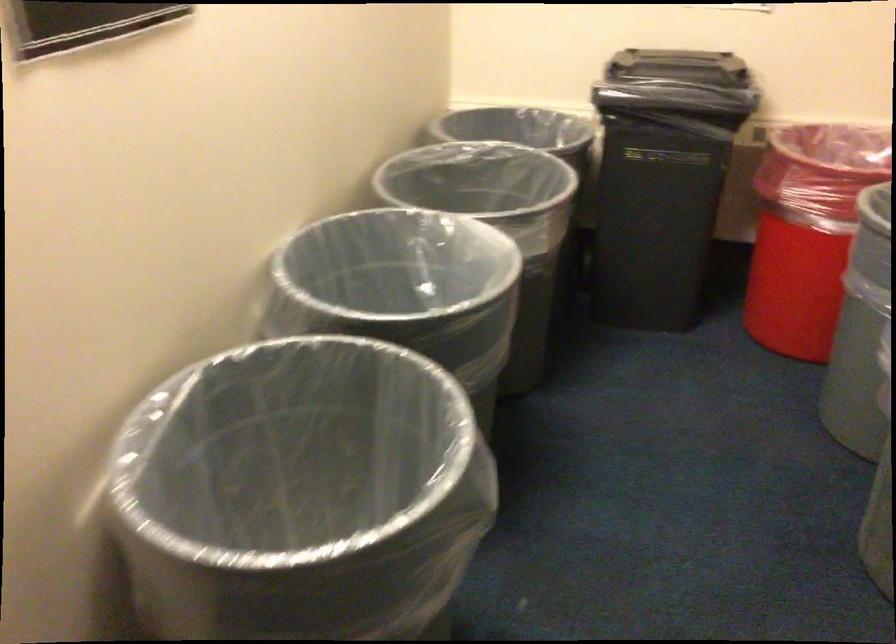
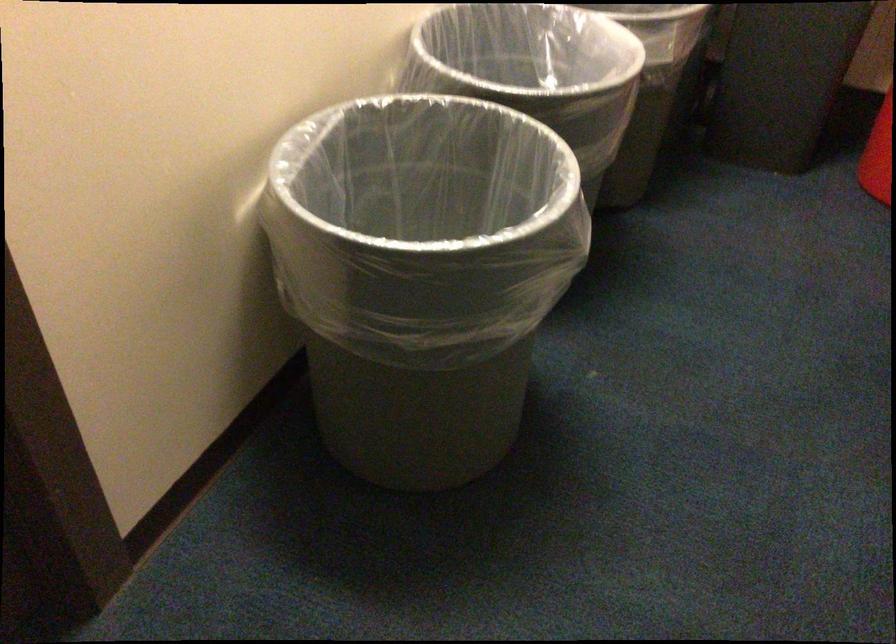
Find the pixel in the second image that matches (445,267) in the first image.

(562, 67)